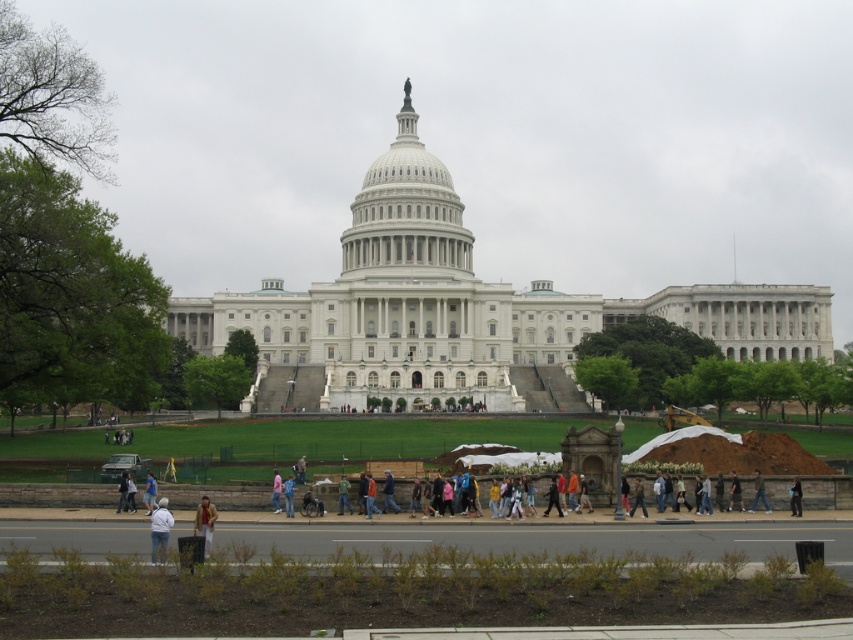
Question: Which object appears farthest from the camera in this image?

Choices:
 (A) light blue shirt at lower center
 (B) dark blue jacket at lower center

Answer: (B)

Question: Is light brown leather jacket at lower left below light brown leather jacket at center?

Choices:
 (A) no
 (B) yes

Answer: (B)

Question: Does blue denim jeans at center appear under dark blue jacket at lower center?

Choices:
 (A) no
 (B) yes

Answer: (B)

Question: Is white cotton shirt at lower center bigger than orange fabric jacket at center?

Choices:
 (A) no
 (B) yes

Answer: (B)

Question: Which object is positioned closest to the light brown leather jacket at lower center?

Choices:
 (A) orange fabric jacket at center
 (B) white matte person at center
 (C) dark brown leather jacket at lower right

Answer: (B)

Question: Which point is farther to the camera?

Choices:
 (A) white matte person at center
 (B) blue denim jeans at center
 (C) camouflage jacket at lower center
 (D) orange fabric jacket at center

Answer: (A)